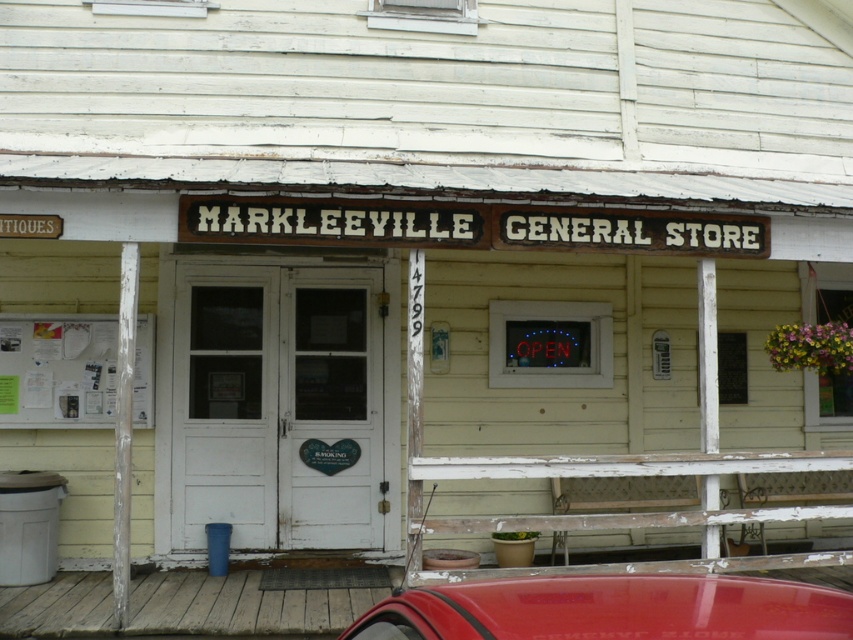
Does shiny red car at lower center have a larger size compared to white paperboard at left?

Indeed, shiny red car at lower center has a larger size compared to white paperboard at left.

Can you confirm if shiny red car at lower center is smaller than white paperboard at left?

Actually, shiny red car at lower center might be larger than white paperboard at left.

Who is more distant from viewer, (566, 592) or (138, 317)?

Positioned behind is point (138, 317).

At what (x,y) coordinates should I click in order to perform the action: click on shiny red car at lower center. Please return your answer as a coordinate pair (x, y). The width and height of the screenshot is (853, 640). Looking at the image, I should click on (610, 609).